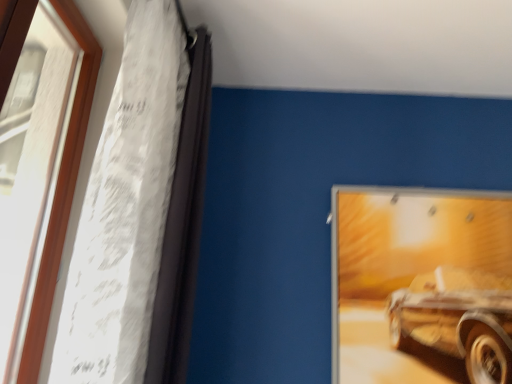
The height and width of the screenshot is (384, 512). What do you see at coordinates (38, 164) in the screenshot?
I see `wooden frame at left` at bounding box center [38, 164].

What do you see at coordinates (421, 281) in the screenshot? Image resolution: width=512 pixels, height=384 pixels. I see `metallic silver picture frame at upper right` at bounding box center [421, 281].

Where is `white sheer fabric at left`? white sheer fabric at left is located at coordinates (127, 210).

Which object is more forward, wooden frame at left or metallic silver picture frame at upper right?

wooden frame at left is closer to the camera.

Is wooden frame at left facing away from metallic silver picture frame at upper right?

No, metallic silver picture frame at upper right is not at the back of wooden frame at left.

How many degrees apart are the facing directions of wooden frame at left and metallic silver picture frame at upper right?

There is a 90.2-degree angle between the facing directions of wooden frame at left and metallic silver picture frame at upper right.

Does white sheer fabric at left have a greater height compared to metallic silver picture frame at upper right?

Yes, white sheer fabric at left is taller than metallic silver picture frame at upper right.

From a real-world perspective, between white sheer fabric at left and metallic silver picture frame at upper right, who is vertically higher?

From a 3D spatial view, white sheer fabric at left is above.

Can you confirm if white sheer fabric at left is bigger than metallic silver picture frame at upper right?

Correct, white sheer fabric at left is larger in size than metallic silver picture frame at upper right.

Is white sheer fabric at left oriented towards metallic silver picture frame at upper right?

No, white sheer fabric at left is not oriented towards metallic silver picture frame at upper right.

Can you see metallic silver picture frame at upper right touching white sheer fabric at left?

No, metallic silver picture frame at upper right is not beside white sheer fabric at left.

In terms of size, does metallic silver picture frame at upper right appear bigger or smaller than white sheer fabric at left?

In the image, metallic silver picture frame at upper right appears to be smaller than white sheer fabric at left.

Considering the relative sizes of metallic silver picture frame at upper right and white sheer fabric at left in the image provided, is metallic silver picture frame at upper right shorter than white sheer fabric at left?

Correct, metallic silver picture frame at upper right is not as tall as white sheer fabric at left.

From the image's perspective, who appears lower, metallic silver picture frame at upper right or white sheer fabric at left?

metallic silver picture frame at upper right appears lower in the image.

Consider the image. Who is shorter, wooden frame at left or white sheer fabric at left?

Standing shorter between the two is wooden frame at left.

From a real-world perspective, which object rests below the other?

From a 3D spatial view, wooden frame at left is below.

Is wooden frame at left positioned with its back to white sheer fabric at left?

Absolutely, wooden frame at left is directed away from white sheer fabric at left.

Find the location of `window above the metallic silver picture frame at upper right (from the image's perspective)`. window above the metallic silver picture frame at upper right (from the image's perspective) is located at coordinates (38, 164).

Is metallic silver picture frame at upper right wider or thinner than wooden frame at left?

metallic silver picture frame at upper right is thinner than wooden frame at left.

Based on the photo, is wooden frame at left at the back of metallic silver picture frame at upper right?

That's not correct — metallic silver picture frame at upper right is not looking away from wooden frame at left.

Considering the positions of objects metallic silver picture frame at upper right and wooden frame at left in the image provided, who is more to the left, metallic silver picture frame at upper right or wooden frame at left?

wooden frame at left.

Who is taller, white sheer fabric at left or wooden frame at left?

white sheer fabric at left is taller.

Is white sheer fabric at left closer to the viewer compared to wooden frame at left?

No, white sheer fabric at left is further to the viewer.

Are white sheer fabric at left and wooden frame at left beside each other?

No, white sheer fabric at left is not making contact with wooden frame at left.

Does white sheer fabric at left have a smaller size compared to wooden frame at left?

Actually, white sheer fabric at left might be larger than wooden frame at left.

Identify the location of window that appears above the metallic silver picture frame at upper right (from the image's perspective). (38, 164).

The width and height of the screenshot is (512, 384). In order to click on curtain on the left side of metallic silver picture frame at upper right in this screenshot , I will do `click(127, 210)`.

Estimate the real-world distances between objects in this image. Which object is further from metallic silver picture frame at upper right, white sheer fabric at left or wooden frame at left?

wooden frame at left is positioned further to the anchor metallic silver picture frame at upper right.

Based on their spatial positions, is wooden frame at left or metallic silver picture frame at upper right further from white sheer fabric at left?

metallic silver picture frame at upper right lies further to white sheer fabric at left than the other object.

Estimate the real-world distances between objects in this image. Which object is closer to white sheer fabric at left, metallic silver picture frame at upper right or wooden frame at left?

wooden frame at left lies closer to white sheer fabric at left than the other object.

Which object lies further to the anchor point wooden frame at left, white sheer fabric at left or metallic silver picture frame at upper right?

metallic silver picture frame at upper right is positioned further to the anchor wooden frame at left.

Looking at the image, which one is located closer to wooden frame at left, metallic silver picture frame at upper right or white sheer fabric at left?

white sheer fabric at left is closer to wooden frame at left.

Estimate the real-world distances between objects in this image. Which object is further from metallic silver picture frame at upper right, wooden frame at left or white sheer fabric at left?

The object further to metallic silver picture frame at upper right is wooden frame at left.

Where is `curtain situated between wooden frame at left and metallic silver picture frame at upper right from left to right`? This screenshot has width=512, height=384. curtain situated between wooden frame at left and metallic silver picture frame at upper right from left to right is located at coordinates (127, 210).